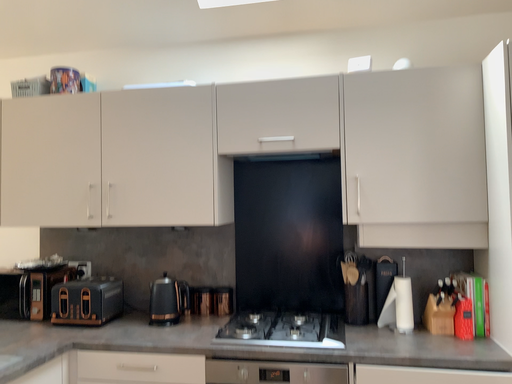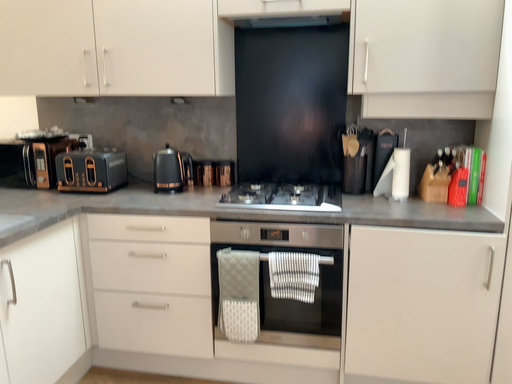
Question: Which way did the camera rotate in the video?

Choices:
 (A) rotated downward
 (B) rotated upward

Answer: (A)